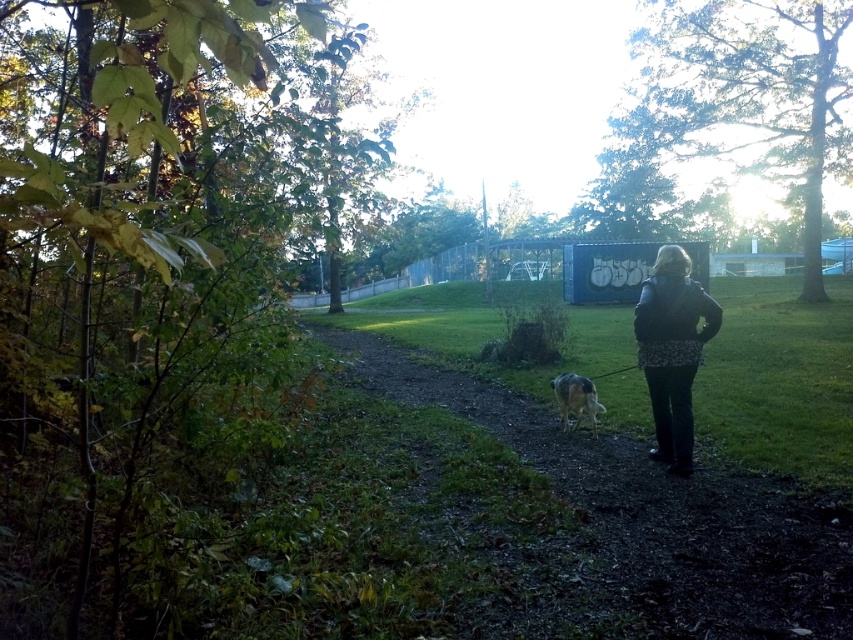
You are standing at the edge of the dirt path at center and want to reach the dark blue leather jacket at right. Which direction should you walk to get closer to the jacket?

The dirt path at center is shorter than the dark blue leather jacket at right, so you should walk towards the right along the dirt path at center to reach the dark blue leather jacket at right.

You are standing at the point marked as point (654, 513) on a map of the dirt path at center. If you walk straight ahead, will you eventually reach the person on the right side of the path?

The point (654, 513) marks the dirt path at center. Since the person is on the right side of the path, walking straight ahead along the dirt path at center may lead you towards the person on the right side depending on the path direction.